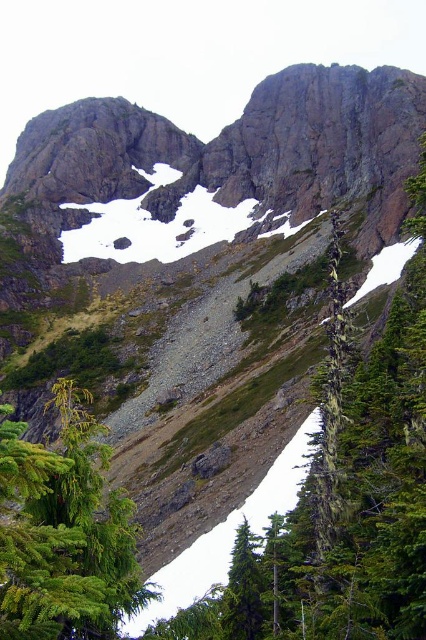
Can you confirm if green matte evergreen tree at lower left is thinner than green matte tree at lower center?

In fact, green matte evergreen tree at lower left might be wider than green matte tree at lower center.

Does green matte evergreen tree at lower left have a greater height compared to green matte tree at lower center?

Yes.

Based on the photo, who is more distant from viewer, (72, 472) or (236, 605)?

Point (236, 605)

In order to click on green matte evergreen tree at lower left in this screenshot , I will do `click(63, 531)`.

Between white powder snow at upper center and green matte tree at lower center, which one has less height?

green matte tree at lower center

Does white powder snow at upper center appear under green matte tree at lower center?

Incorrect, white powder snow at upper center is not positioned below green matte tree at lower center.

Is point (137, 218) closer to viewer compared to point (242, 624)?

No, (137, 218) is further to viewer.

This screenshot has height=640, width=426. I want to click on white powder snow at upper center, so [154, 225].

Is green matte evergreen tree at lower left shorter than white powder snow at upper center?

Yes, green matte evergreen tree at lower left is shorter than white powder snow at upper center.

Which is above, green matte evergreen tree at lower left or white powder snow at upper center?

Positioned higher is white powder snow at upper center.

What do you see at coordinates (63, 531) in the screenshot? I see `green matte evergreen tree at lower left` at bounding box center [63, 531].

In order to click on green matte evergreen tree at lower left in this screenshot , I will do `click(63, 531)`.